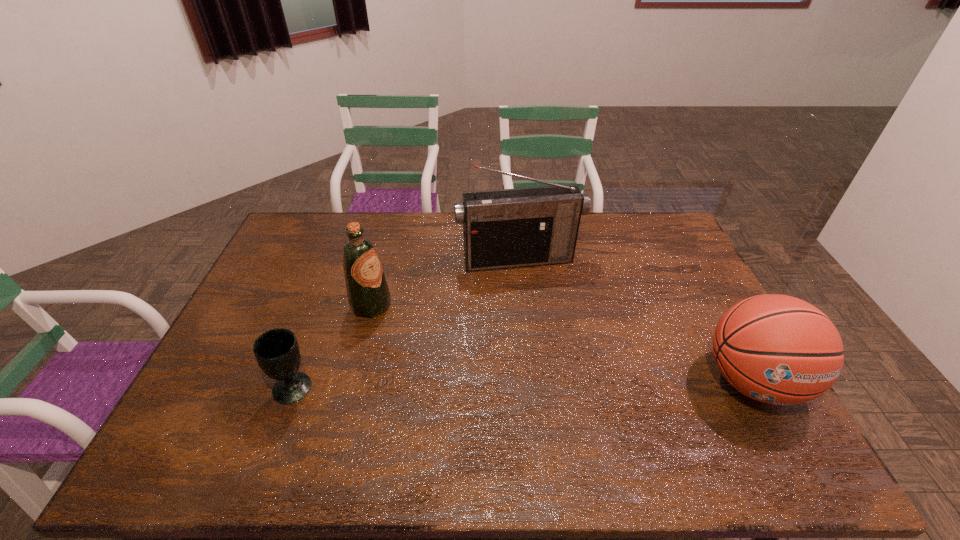
Locate an element on the screen. This screenshot has height=540, width=960. blank region between the leftmost object and the rightmost object is located at coordinates (523, 384).

What are the coordinates of `vacant space in between the second object from left to right and the farthest object` in the screenshot? It's located at (444, 282).

I want to click on free spot between the basketball and the olive oil, so click(562, 343).

The image size is (960, 540). I want to click on empty space between the leftmost object and the second object from left to right, so click(332, 347).

Image resolution: width=960 pixels, height=540 pixels. Find the location of `object that is the closest to the rightmost object`. object that is the closest to the rightmost object is located at coordinates (506, 228).

Choose which object is the second nearest neighbor to the chalice. Please provide its 2D coordinates. Your answer should be formatted as a tuple, i.e. [(x, y)], where the tuple contains the x and y coordinates of a point satisfying the conditions above.

[(506, 228)]

I want to click on vacant space that satisfies the following two spatial constraints: 1. on the back side of the third nearest object; 2. on the right side of the third object from left to right, so click(383, 259).